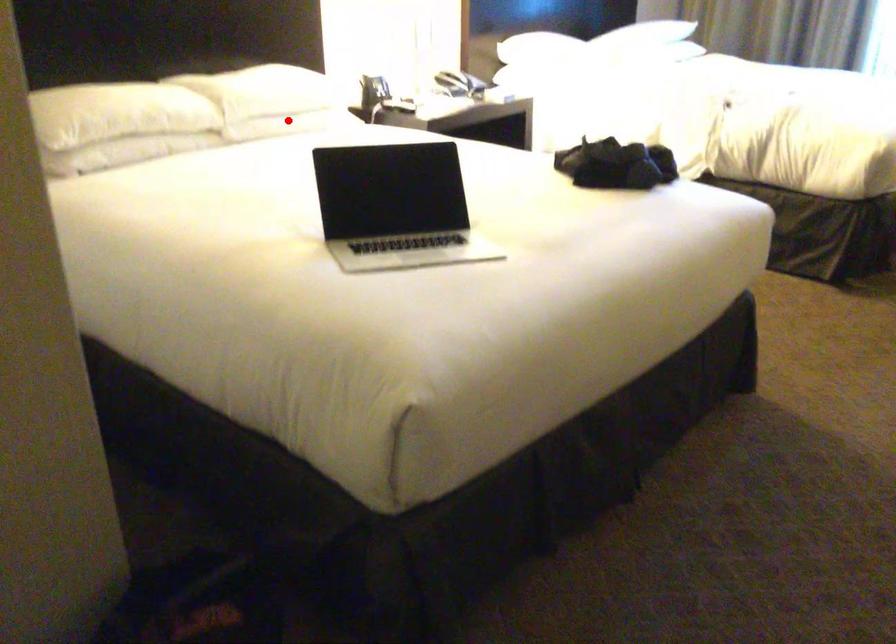
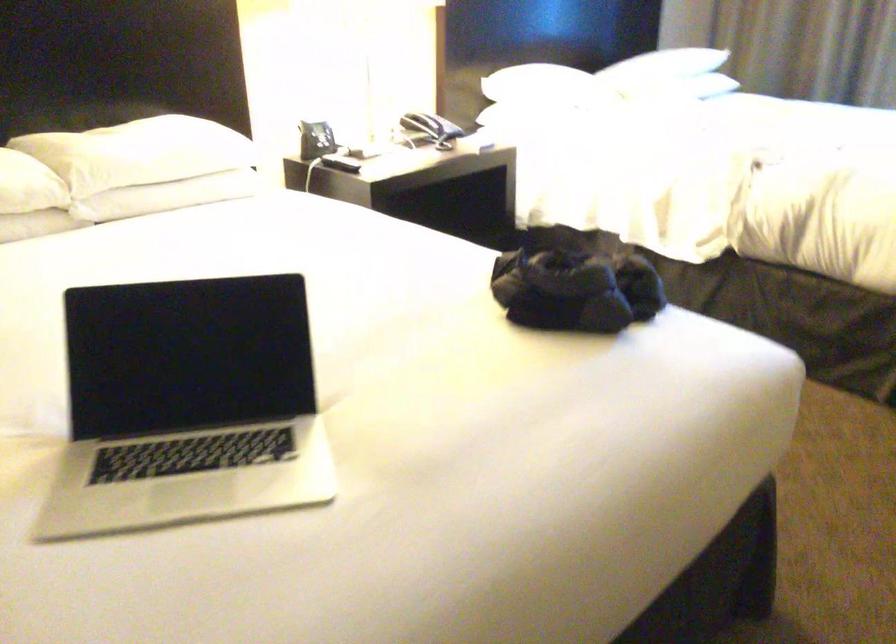
Locate, in the second image, the point that corresponds to the highlighted location in the first image.

(167, 196)